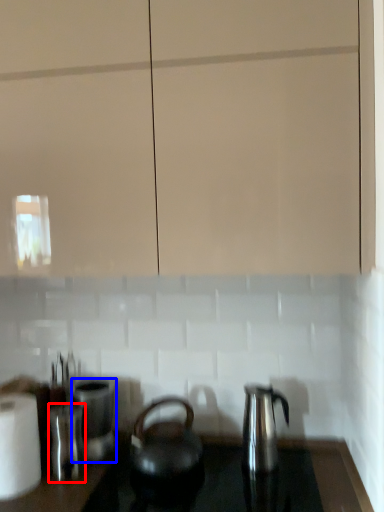
Question: Which object is closer to the camera taking this photo, appliance (highlighted by a red box) or appliance (highlighted by a blue box)?

Choices:
 (A) appliance
 (B) appliance

Answer: (A)